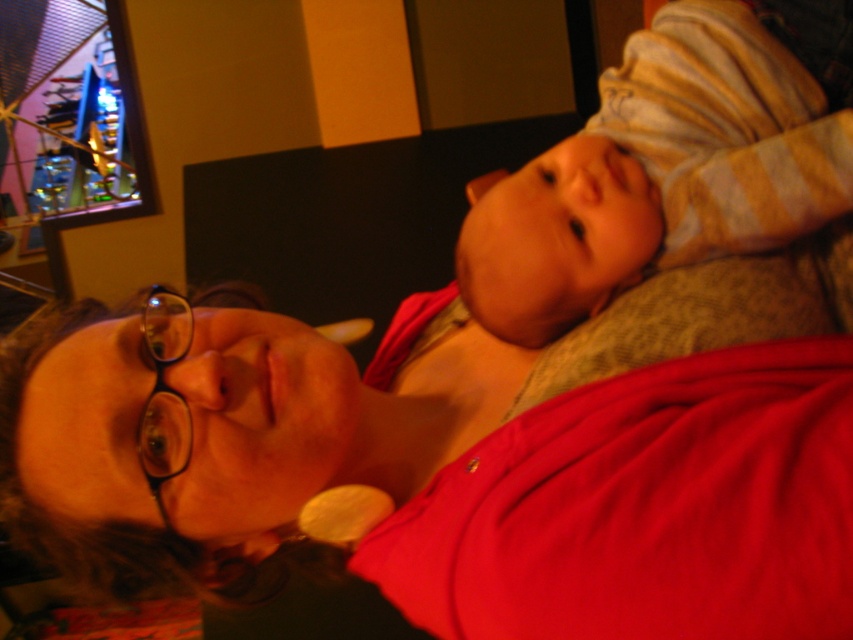
Who is positioned more to the left, matte red shirt at center or striped cotton onesie at upper right?

From the viewer's perspective, matte red shirt at center appears more on the left side.

Who is taller, matte red shirt at center or striped cotton onesie at upper right?

striped cotton onesie at upper right is taller.

What do you see at coordinates (442, 472) in the screenshot? Image resolution: width=853 pixels, height=640 pixels. I see `matte red shirt at center` at bounding box center [442, 472].

Find the location of `matte red shirt at center`. matte red shirt at center is located at coordinates (442, 472).